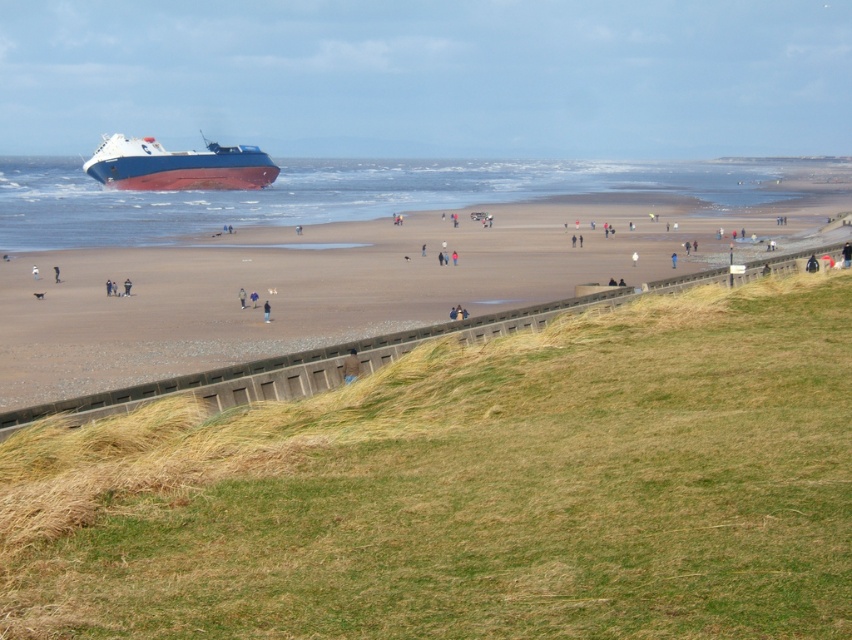
Question: Is blue matte ship at upper left to the left of brown fuzzy jacket at lower center from the viewer's perspective?

Choices:
 (A) yes
 (B) no

Answer: (A)

Question: Based on their relative distances, which object is farther from the brown sandy beach at upper center?

Choices:
 (A) brown fuzzy jacket at lower center
 (B) blue matte ship at upper left

Answer: (A)

Question: Can you confirm if brown sandy beach at upper center is bigger than brown fuzzy jacket at lower center?

Choices:
 (A) no
 (B) yes

Answer: (B)

Question: Considering the real-world distances, which object is closest to the brown sandy beach at upper center?

Choices:
 (A) brown fuzzy jacket at lower center
 (B) blue matte ship at upper left

Answer: (B)

Question: Can you confirm if blue matte ship at upper left is positioned below brown fuzzy jacket at lower center?

Choices:
 (A) yes
 (B) no

Answer: (B)

Question: Estimate the real-world distances between objects in this image. Which object is farther from the blue matte ship at upper left?

Choices:
 (A) brown sandy beach at upper center
 (B) brown fuzzy jacket at lower center

Answer: (B)